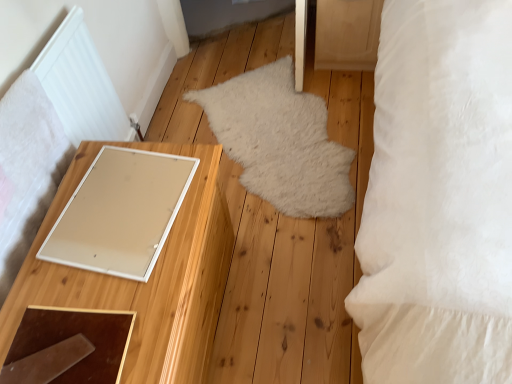
Where is `free space above white matte mirror at left (from a real-world perspective)`? This screenshot has height=384, width=512. free space above white matte mirror at left (from a real-world perspective) is located at coordinates [x=103, y=235].